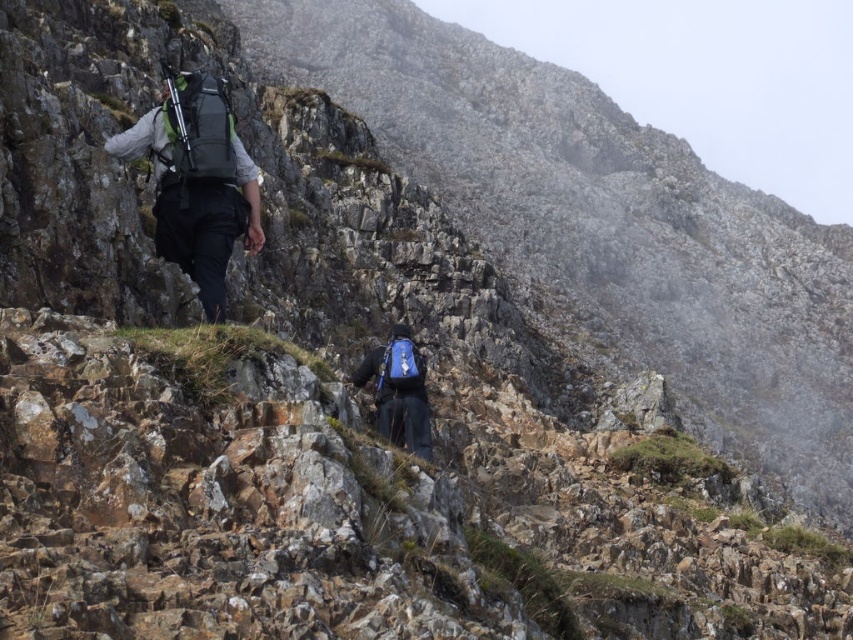
You are a drone operator trying to capture aerial footage of the mountain hikers. You need to fly your drone from the first hiker at point (x=235, y=141) to the second hiker at point (x=422, y=396). Considering the mountain terrain, which hiker is closer to the drone when it starts its flight?

Point (x=235, y=141) is closer to the viewer than point (x=422, y=396), so the drone will be closer to the first hiker at point (x=235, y=141) when it starts its flight.